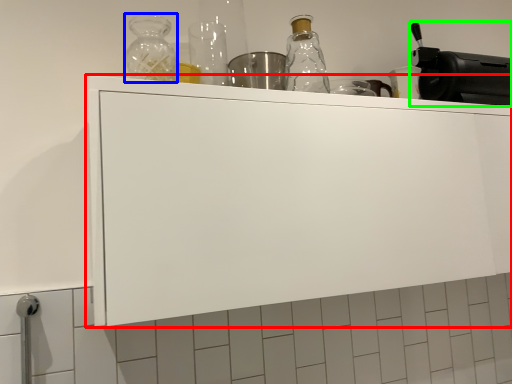
Question: Estimate the real-world distances between objects in this image. Which object is farther from cabinetry (highlighted by a red box), bottle (highlighted by a blue box) or appliance (highlighted by a green box)?

Choices:
 (A) bottle
 (B) appliance

Answer: (B)